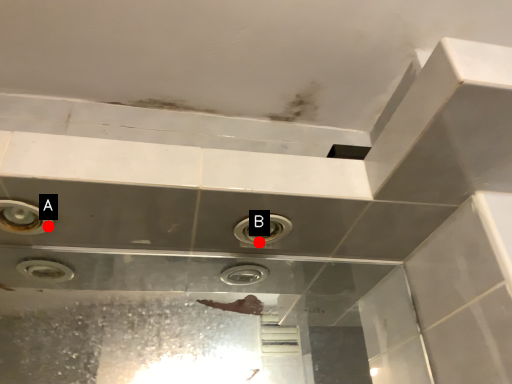
Question: Two points are circled on the image, labeled by A and B beside each circle. Among these points, which one is farthest from the camera?

Choices:
 (A) A is further
 (B) B is further

Answer: (B)